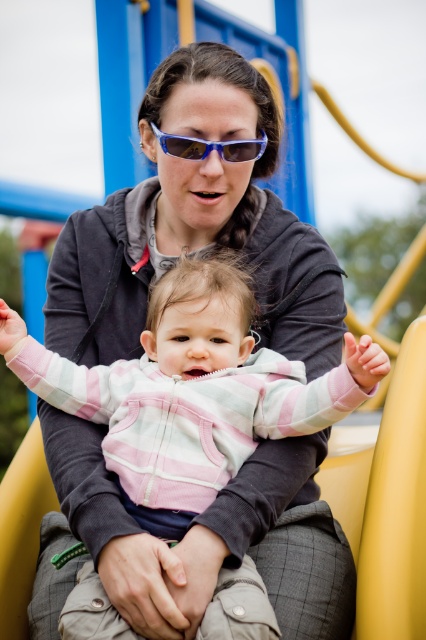
What is the exact location of the pink striped fleece at center in the image?

The pink striped fleece at center is located at point coordinates of (192,387).

The scene shows a woman and a baby at a playground. The woman is sitting on a yellow slide, holding the baby in a striped sweater. There is a point labeled at coordinates (192, 387). What object does this point correspond to?

The point corresponds to the pink striped fleece at center.

Looking at this image, you are standing at the playground and want to take a photo of the two points mentioned. Which point, point (x=224, y=369) or point (x=239, y=157), is closer to you?

Point (x=224, y=369) is closer to the camera than point (x=239, y=157), so it is closer to you.